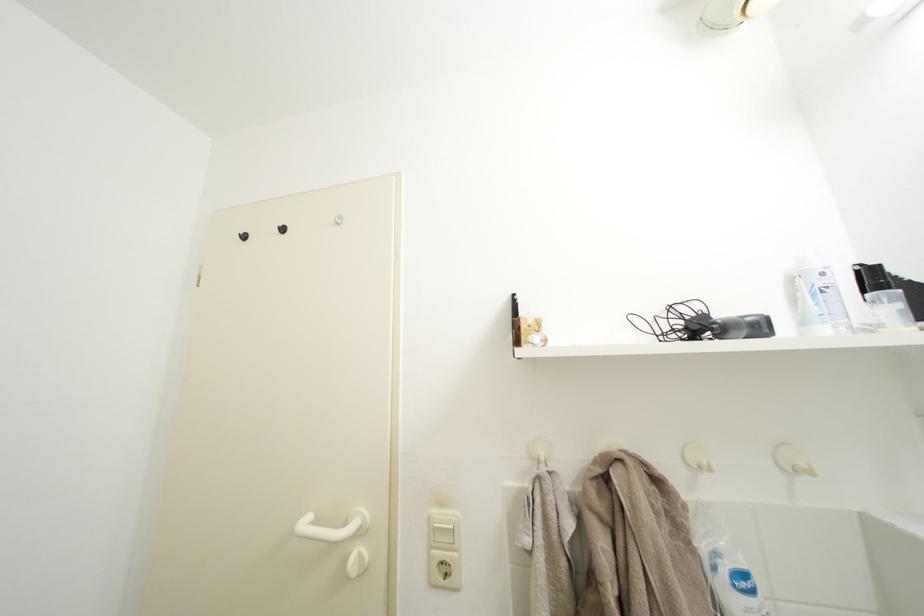
This screenshot has height=616, width=924. In order to click on white door handle in this screenshot , I will do `click(324, 530)`.